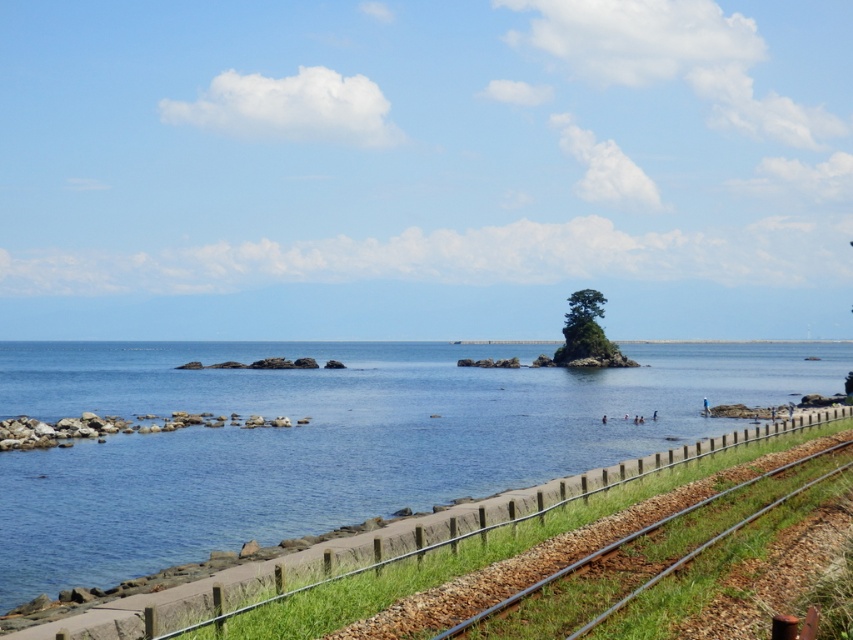
You are standing on the metallic rail at lower right and want to move towards the clear blue water at center. In which direction should you walk?

You should walk to the left because the clear blue water at center is to the right of the metallic rail at lower right, so moving left from the rail will take you towards the water.

You are standing at the point with coordinates point (746,380) and want to walk to the point with coordinates point (527,602). Which direction should you move to get closer to your destination?

To move from point (746,380) to point (527,602), you should move northeast because point (527,602) is northeast of point (746,380).

You are standing at the edge of the scene and want to cross to the island in the center. You see the clear blue water at center and the metallic rail at lower right. Which object is higher in elevation?

The clear blue water at center is taller than the metallic rail at lower right, so the clear blue water at center has a higher elevation.